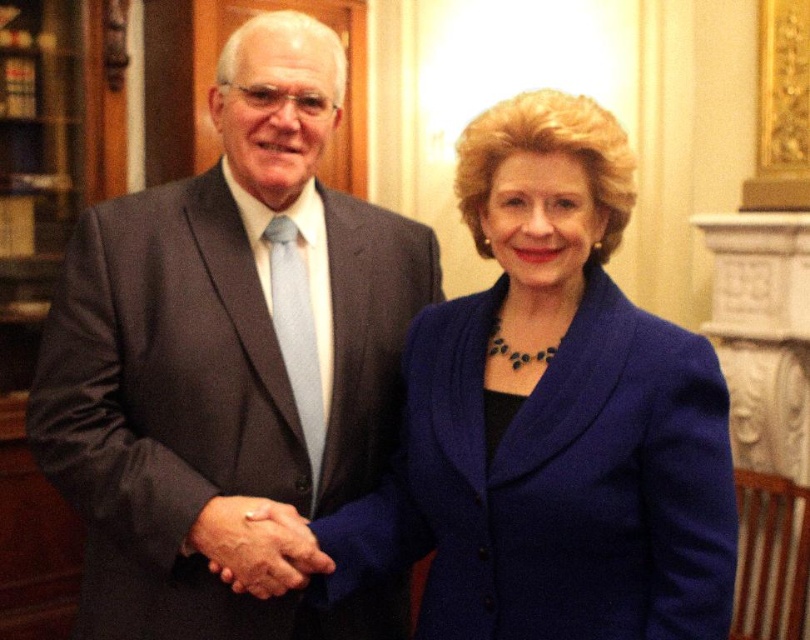
You are a photographer setting up for a formal event. You need to ensure that the blue woolen blazer at center and the smooth skin handshake at center are both visible in the frame. Based on their positions, which object is closer to the camera?

The blue woolen blazer at center is positioned over the smooth skin handshake at center, meaning it is closer to the camera.